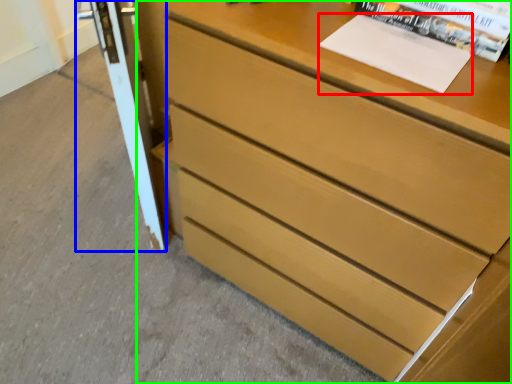
Question: Estimate the real-world distances between objects in this image. Which object is closer to paperback book (highlighted by a red box), screen door (highlighted by a blue box) or chest of drawers (highlighted by a green box)?

Choices:
 (A) screen door
 (B) chest of drawers

Answer: (B)